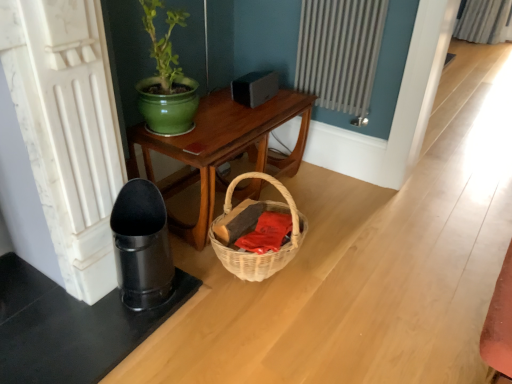
Question: From the image's perspective, is green ceramic pot at upper center above or below red cotton cloth at lower center?

Choices:
 (A) above
 (B) below

Answer: (A)

Question: Is point (144, 3) positioned closer to the camera than point (288, 223)?

Choices:
 (A) closer
 (B) farther

Answer: (A)

Question: Based on their relative distances, which object is nearer to the woven wood table at center?

Choices:
 (A) green ceramic pot at upper center
 (B) red cotton cloth at lower center
 (C) white textured radiator at upper center

Answer: (A)

Question: Which object is positioned farthest from the green ceramic pot at upper center?

Choices:
 (A) woven wood table at center
 (B) white textured radiator at upper center
 (C) red cotton cloth at lower center

Answer: (B)